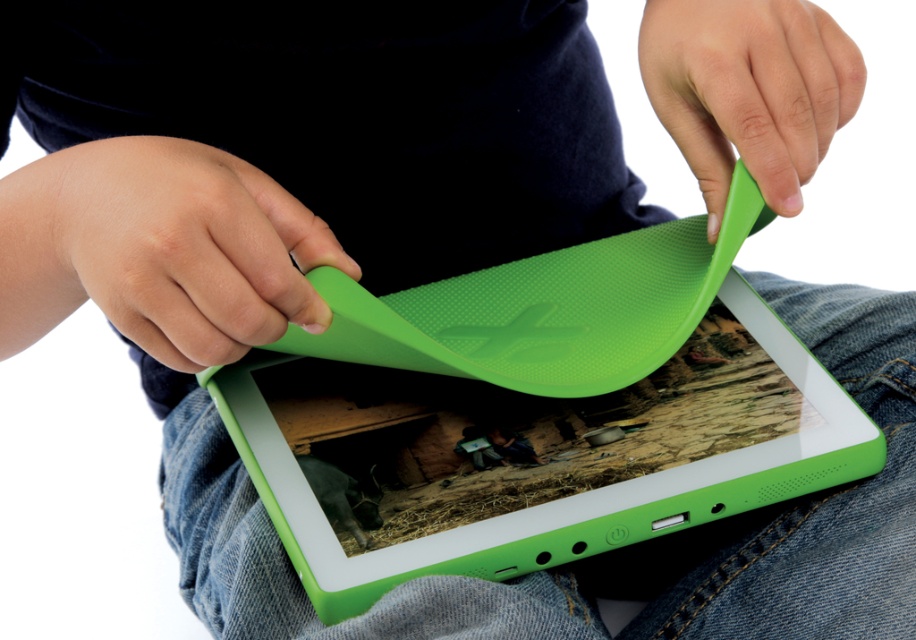
Question: Among these objects, which one is farthest from the camera?

Choices:
 (A) green matte tablet cover at upper left
 (B) green rubber tablet at center

Answer: (B)

Question: Can you confirm if green rubber tablet at center is positioned to the right of green matte/silicone handle at upper right?

Choices:
 (A) no
 (B) yes

Answer: (A)

Question: Which object is farther from the camera taking this photo?

Choices:
 (A) green matte/silicone handle at upper right
 (B) green rubber tablet at center

Answer: (A)

Question: Considering the real-world distances, which object is farthest from the green rubber tablet at center?

Choices:
 (A) green matte tablet cover at upper left
 (B) green matte/silicone handle at upper right

Answer: (B)

Question: Is green rubber tablet at center wider than green matte/silicone handle at upper right?

Choices:
 (A) yes
 (B) no

Answer: (A)

Question: Does green rubber tablet at center appear over green matte/silicone handle at upper right?

Choices:
 (A) no
 (B) yes

Answer: (A)